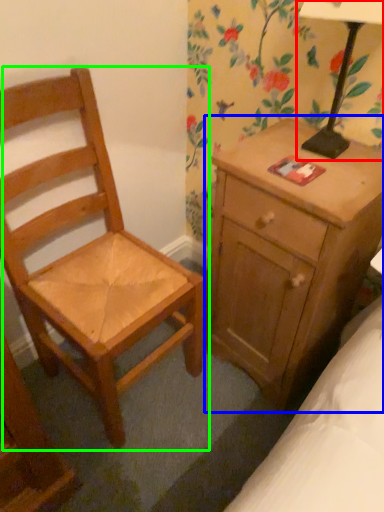
Question: Considering the real-world distances, which object is farthest from table lamp (highlighted by a red box)? nightstand (highlighted by a blue box) or chair (highlighted by a green box)?

Choices:
 (A) nightstand
 (B) chair

Answer: (B)